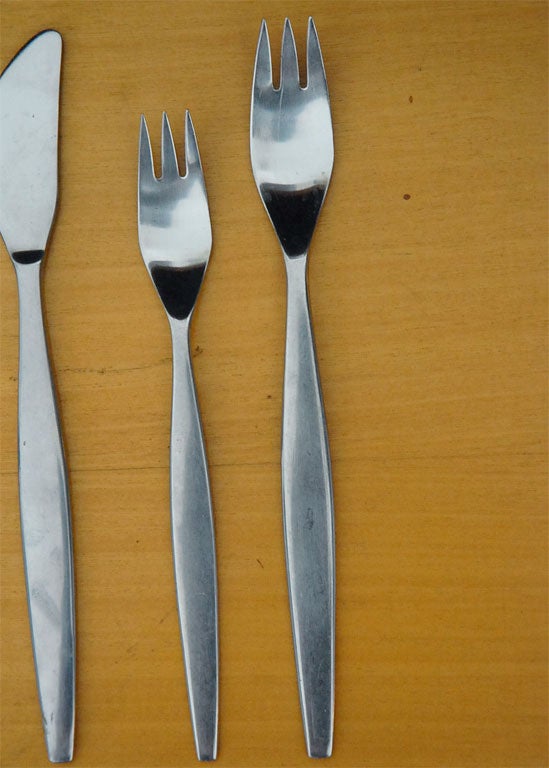
Where is `wood table background`? The height and width of the screenshot is (768, 549). wood table background is located at coordinates (468, 68), (408, 406), (100, 432), (136, 81).